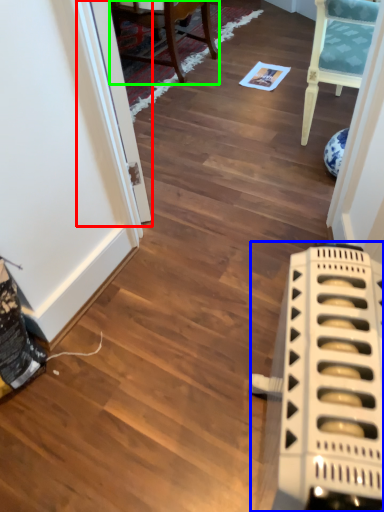
Question: Considering the real-world distances, which object is closest to glass door (highlighted by a red box)? appliance (highlighted by a blue box) or chair (highlighted by a green box).

Choices:
 (A) appliance
 (B) chair

Answer: (A)